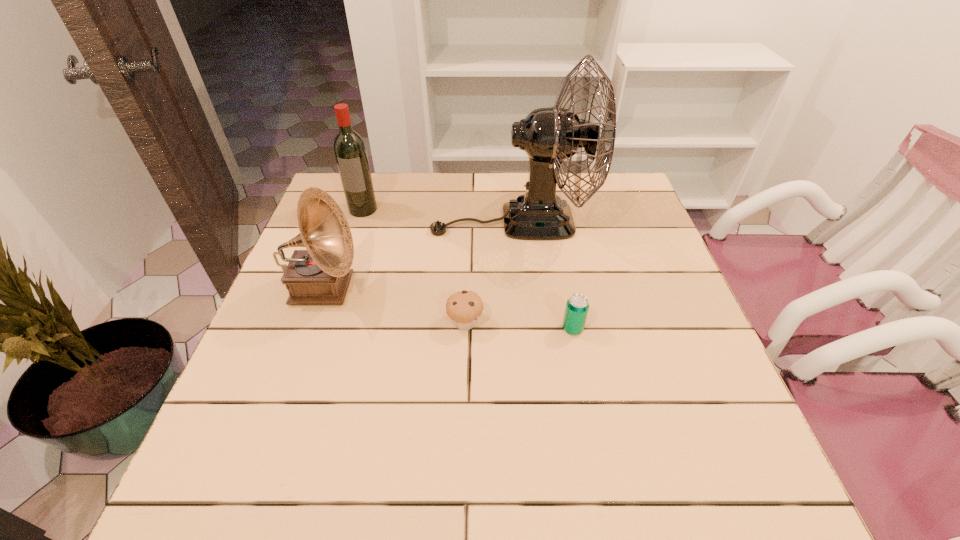
Locate an element on the screen. The height and width of the screenshot is (540, 960). fan is located at coordinates (549, 135).

At what (x,y) coordinates should I click in order to perform the action: click on wine bottle. Please return your answer as a coordinate pair (x, y). The width and height of the screenshot is (960, 540). Looking at the image, I should click on (350, 151).

Locate an element on the screen. The width and height of the screenshot is (960, 540). the third tallest object is located at coordinates (320, 275).

The image size is (960, 540). I want to click on beer can, so click(x=577, y=306).

In order to click on the shortest object in this screenshot , I will do `click(464, 308)`.

Where is `free spot located 0.320m in front of the tallest object, indicating the direction of air flow`? free spot located 0.320m in front of the tallest object, indicating the direction of air flow is located at coordinates (320, 221).

The width and height of the screenshot is (960, 540). Identify the location of vacant region located in front of the tallest object, indicating the direction of air flow. (330, 221).

Image resolution: width=960 pixels, height=540 pixels. What are the coordinates of `free location located 0.140m in front of the tallest object, indicating the direction of air flow` in the screenshot? It's located at (383, 221).

Locate an element on the screen. Image resolution: width=960 pixels, height=540 pixels. vacant point located 0.280m on the label of the wine bottle is located at coordinates (338, 286).

Where is `free space located on the horn of the phonograph record`? free space located on the horn of the phonograph record is located at coordinates (408, 289).